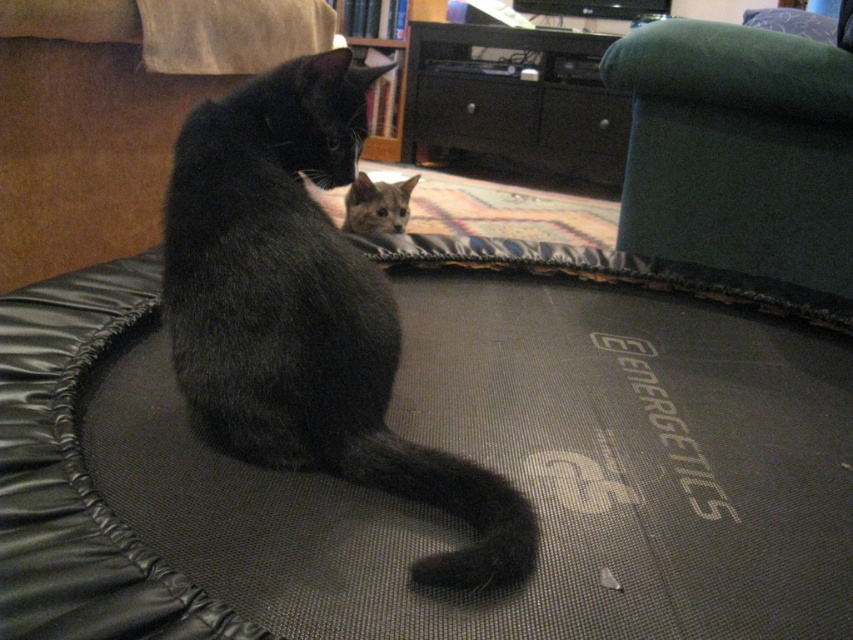
Find the location of `black matte fur cat at center`. black matte fur cat at center is located at coordinates (306, 310).

Does black matte fur cat at center lie behind green fabric bean bag at upper right?

No, black matte fur cat at center is closer to the viewer.

The height and width of the screenshot is (640, 853). In order to click on black matte fur cat at center in this screenshot , I will do `click(306, 310)`.

Can you confirm if black fabric dog bed at center is thinner than gray fur cat at center?

Incorrect, black fabric dog bed at center's width is not less than gray fur cat at center's.

Is black fabric dog bed at center taller than gray fur cat at center?

Yes.

Measure the distance between black fabric dog bed at center and camera.

black fabric dog bed at center and camera are 19.13 inches apart.

This screenshot has width=853, height=640. Find the location of `black fabric dog bed at center`. black fabric dog bed at center is located at coordinates (78, 480).

Can you confirm if green fabric bean bag at upper right is positioned to the left of gray fur cat at center?

No, green fabric bean bag at upper right is not to the left of gray fur cat at center.

Who is more distant from viewer, (x=726, y=44) or (x=376, y=230)?

The point (x=376, y=230) is behind.

Identify the location of green fabric bean bag at upper right. The width and height of the screenshot is (853, 640). (737, 150).

Locate an element on the screen. The height and width of the screenshot is (640, 853). green fabric bean bag at upper right is located at coordinates (737, 150).